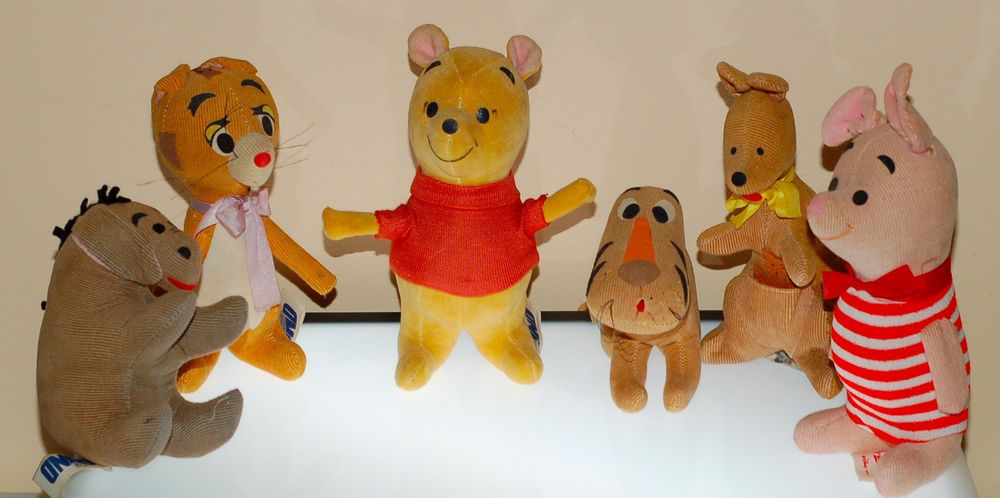
Locate an element on the screen. Image resolution: width=1000 pixels, height=498 pixels. stuffed toys is located at coordinates pyautogui.click(x=138, y=369), pyautogui.click(x=249, y=190), pyautogui.click(x=458, y=240), pyautogui.click(x=629, y=284), pyautogui.click(x=773, y=176), pyautogui.click(x=850, y=228).